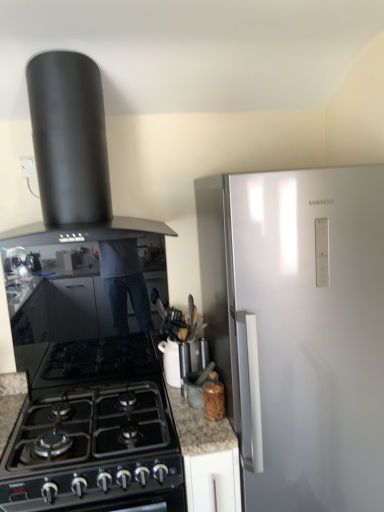
I want to click on vacant area that lies in front of brown glass bottle at lower center, which is counted as the third kitchen appliance, starting from the left, so click(x=216, y=430).